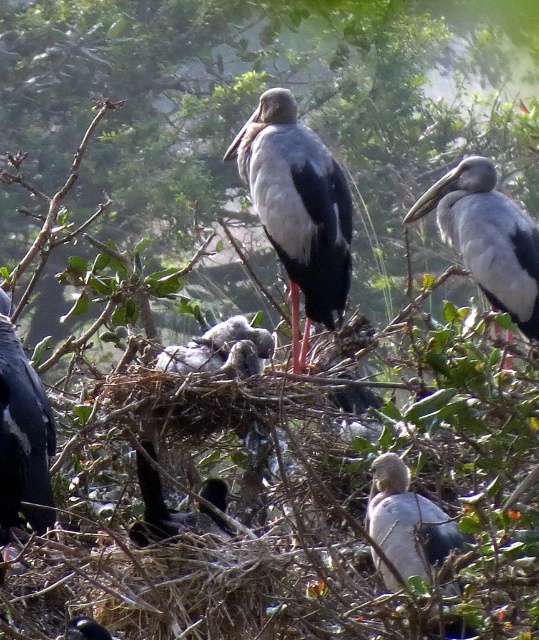
Question: Which is farther from the matte black bird at left?

Choices:
 (A) gray downy feathers at center
 (B) gray matte bird at center

Answer: (B)

Question: Which of the following is the farthest from the observer?

Choices:
 (A) gray downy feathers at center
 (B) matte black bird at left

Answer: (A)

Question: Is gray matte bird at center bigger than gray matte stork at upper right?

Choices:
 (A) yes
 (B) no

Answer: (A)

Question: Is gray downy feathers at center positioned in front of black glossy bird at center?

Choices:
 (A) yes
 (B) no

Answer: (B)

Question: Which is farther from the shiny black bird at center?

Choices:
 (A) matte black bird at left
 (B) gray downy feathers at center
 (C) gray matte stork at upper right

Answer: (C)

Question: Is matte black bird at left positioned at the back of white matte bird at lower center?

Choices:
 (A) no
 (B) yes

Answer: (B)